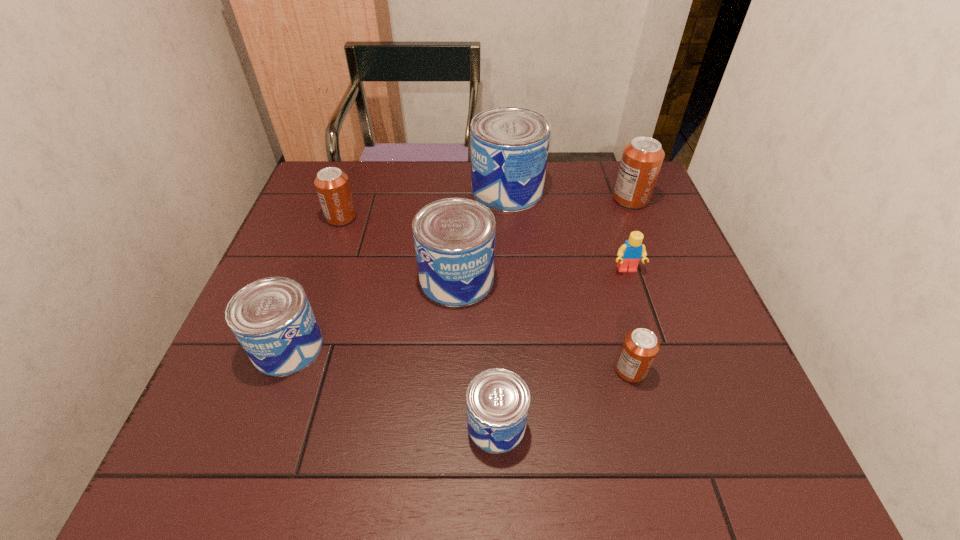
You are a GUI agent. You are given a task and a screenshot of the screen. Output one action in this format:
    pyautogui.click(x=<x>, y=<y>)
    Task: Click on the free space located on the front label of the second nearest blue can
    This screenshot has width=960, height=540.
    Given the screenshot: What is the action you would take?
    pyautogui.click(x=469, y=347)

The width and height of the screenshot is (960, 540). I want to click on free space located on the front-facing side of the Lego, so click(649, 340).

Find the location of a particular element. The width and height of the screenshot is (960, 540). vacant region located on the back of the second can from right to left is located at coordinates (593, 234).

Identify the location of free spot located 0.250m on the front label of the nearest blue can. (331, 425).

I want to click on blank area located 0.110m on the front label of the nearest blue can, so click(407, 425).

At what (x,y) coordinates should I click in order to perform the action: click on vacant area located on the front label of the nearest blue can. Please return your answer as a coordinate pair (x, y). Looking at the image, I should click on (315, 425).

Locate an element on the screen. The image size is (960, 540). object at the near edge is located at coordinates (497, 400).

Where is `can that is at the right edge`? This screenshot has height=540, width=960. can that is at the right edge is located at coordinates (641, 161).

Locate an element on the screen. This screenshot has height=540, width=960. Lego present at the right edge is located at coordinates (629, 254).

This screenshot has height=540, width=960. What are the coordinates of `object that is at the far right corner` in the screenshot? It's located at (641, 161).